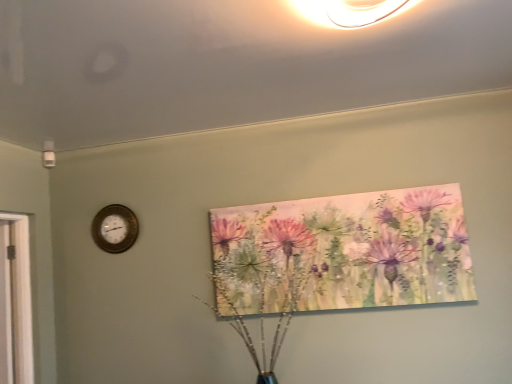
Question: Can you confirm if wooden clock at left is thinner than watercolor painting at upper center?

Choices:
 (A) yes
 (B) no

Answer: (A)

Question: Considering the relative sizes of wooden clock at left and watercolor painting at upper center in the image provided, is wooden clock at left shorter than watercolor painting at upper center?

Choices:
 (A) no
 (B) yes

Answer: (B)

Question: Is wooden clock at left at the right side of watercolor painting at upper center?

Choices:
 (A) no
 (B) yes

Answer: (A)

Question: Considering the relative sizes of wooden clock at left and watercolor painting at upper center in the image provided, is wooden clock at left bigger than watercolor painting at upper center?

Choices:
 (A) yes
 (B) no

Answer: (B)

Question: Considering the relative positions of wooden clock at left and watercolor painting at upper center in the image provided, is wooden clock at left to the left of watercolor painting at upper center from the viewer's perspective?

Choices:
 (A) yes
 (B) no

Answer: (A)

Question: Is wooden clock at left positioned with its back to watercolor painting at upper center?

Choices:
 (A) no
 (B) yes

Answer: (A)

Question: Can you confirm if watercolor painting at upper center is bigger than wooden clock at left?

Choices:
 (A) yes
 (B) no

Answer: (A)

Question: Does watercolor painting at upper center have a greater height compared to wooden clock at left?

Choices:
 (A) yes
 (B) no

Answer: (A)

Question: Does watercolor painting at upper center turn towards wooden clock at left?

Choices:
 (A) no
 (B) yes

Answer: (A)

Question: Is watercolor painting at upper center at the right side of wooden clock at left?

Choices:
 (A) no
 (B) yes

Answer: (B)

Question: Is watercolor painting at upper center surrounding wooden clock at left?

Choices:
 (A) no
 (B) yes

Answer: (A)

Question: From a real-world perspective, is watercolor painting at upper center positioned over wooden clock at left based on gravity?

Choices:
 (A) no
 (B) yes

Answer: (A)

Question: Considering the positions of wooden clock at left and watercolor painting at upper center in the image, is wooden clock at left taller or shorter than watercolor painting at upper center?

Choices:
 (A) short
 (B) tall

Answer: (A)